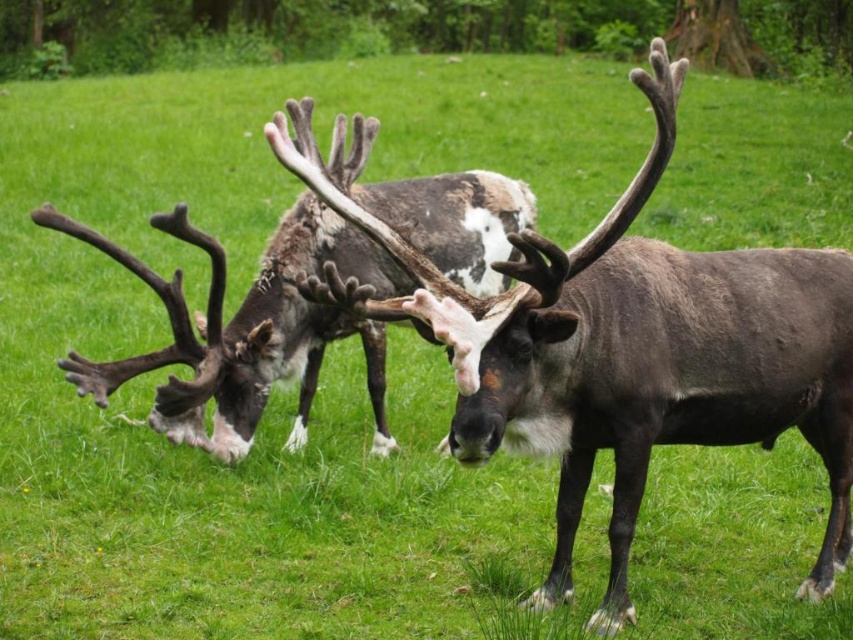
Measure the distance between dark brown fur antlers at center and speckled fur reindeer at center.

dark brown fur antlers at center and speckled fur reindeer at center are 1.02 meters apart from each other.

Is dark brown fur antlers at center further to the viewer compared to speckled fur reindeer at center?

No, it is in front of speckled fur reindeer at center.

Between point (691, 278) and point (177, 433), which one is positioned behind?

The point (177, 433) is behind.

Find the location of a particular element. dark brown fur antlers at center is located at coordinates (622, 349).